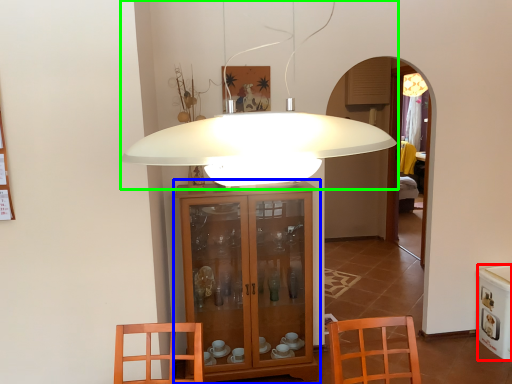
Question: Which object is positioned farthest from appliance (highlighted by a red box)? Select from cabinetry (highlighted by a blue box) and lamp (highlighted by a green box).

Choices:
 (A) cabinetry
 (B) lamp

Answer: (B)